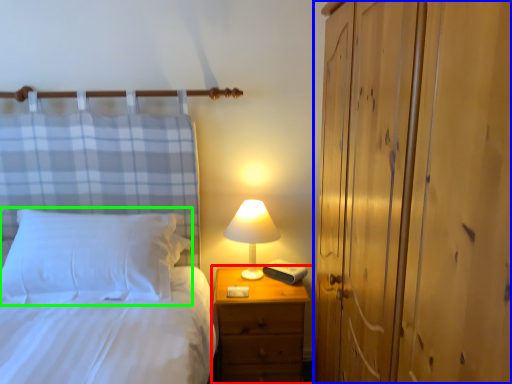
Question: Estimate the real-world distances between objects in this image. Which object is closer to nightstand (highlighted by a red box), dresser (highlighted by a blue box) or pillow (highlighted by a green box)?

Choices:
 (A) dresser
 (B) pillow

Answer: (B)